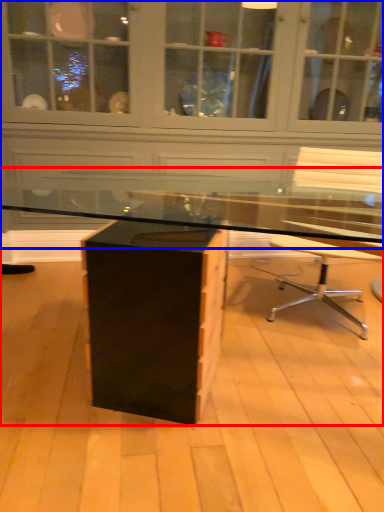
Question: Which of the following is the closest to the observer, desk (highlighted by a red box) or dresser (highlighted by a blue box)?

Choices:
 (A) desk
 (B) dresser

Answer: (A)